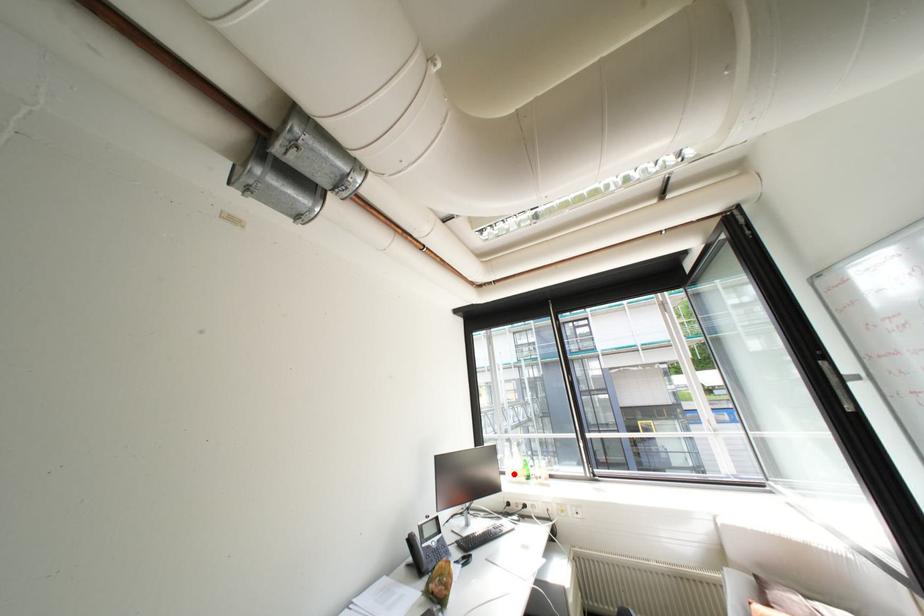
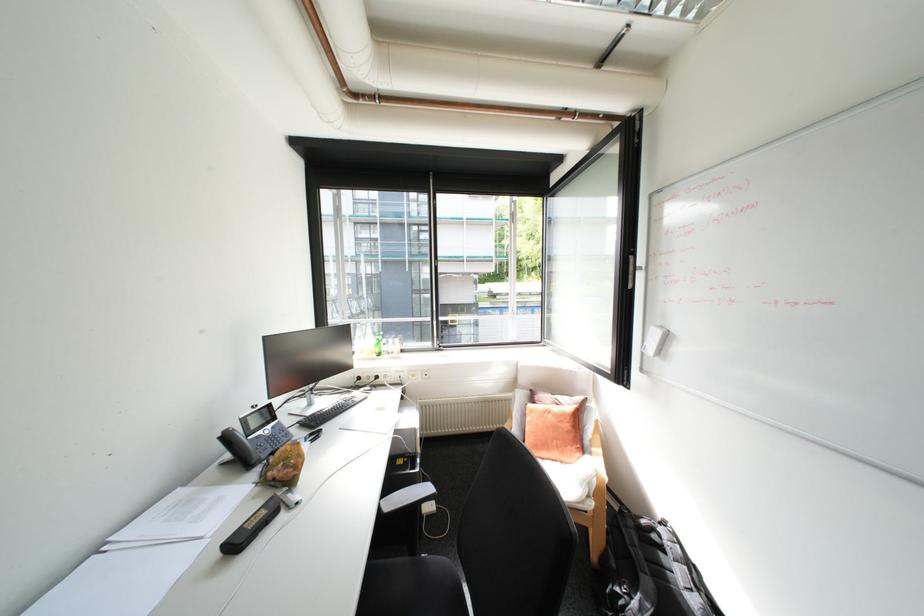
Question: I am providing you with two images of the same scene from different viewpoints. Given a red point in image1, look at the same physical point in image2. Is it:

Choices:
 (A) Closer to the viewpoint
 (B) Farther from the viewpoint

Answer: (A)